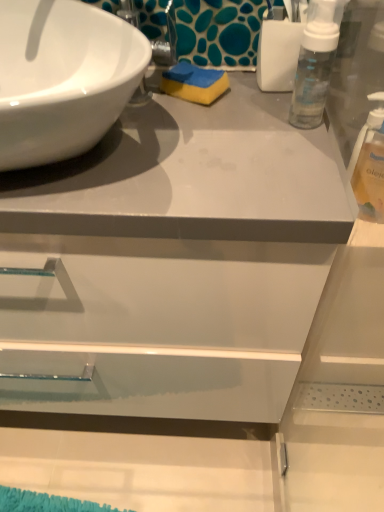
This screenshot has width=384, height=512. I want to click on space that is in front of blue/yellow sponge at center, so click(198, 146).